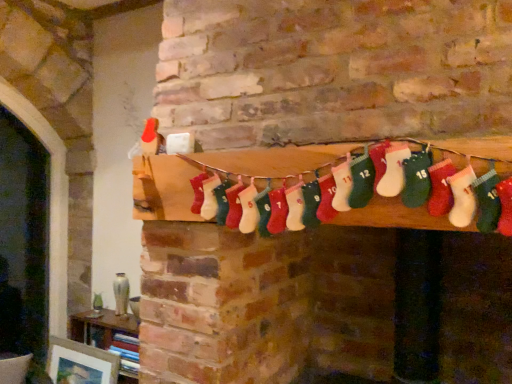
What is the approximate width of wooden bookshelf at lower left?

The width of wooden bookshelf at lower left is 22.72 centimeters.

Where is `red knitted stocking at center`? The height and width of the screenshot is (384, 512). red knitted stocking at center is located at coordinates pyautogui.click(x=338, y=186).

Identify the location of wooden bookshelf at lower left. (101, 327).

Measure the distance between red knitted stocking at center and wooden bookshelf at lower left.

They are 5.49 feet apart.

From the image's perspective, is red knitted stocking at center positioned above or below wooden bookshelf at lower left?

Based on their image positions, red knitted stocking at center is located above wooden bookshelf at lower left.

Which object is thinner, red knitted stocking at center or wooden bookshelf at lower left?

red knitted stocking at center.

Is red knitted stocking at center behind wooden bookshelf at lower left?

No, it is in front of wooden bookshelf at lower left.

Based on their positions, is matte white picture frame at lower left located to the left or right of red knitted stocking at center?

matte white picture frame at lower left is positioned on red knitted stocking at center's left side.

Between point (106, 357) and point (184, 203), which one is positioned behind?

The point (106, 357) is farther from the camera.

Is red knitted stocking at center inside matte white picture frame at lower left?

No, red knitted stocking at center is not inside matte white picture frame at lower left.

Which of these two, matte white picture frame at lower left or red knitted stocking at center, stands shorter?

red knitted stocking at center is shorter.

Considering the sizes of red knitted stocking at center and matte white picture frame at lower left in the image, is red knitted stocking at center taller or shorter than matte white picture frame at lower left?

Clearly, red knitted stocking at center is shorter compared to matte white picture frame at lower left.

Is red knitted stocking at center aimed at matte white picture frame at lower left?

No, red knitted stocking at center does not turn towards matte white picture frame at lower left.

From a real-world perspective, who is located higher, red knitted stocking at center or matte white picture frame at lower left?

red knitted stocking at center is physically above.

Which is more to the right, wooden bookshelf at lower left or red knitted stocking at center?

red knitted stocking at center is more to the right.

Which is correct: wooden bookshelf at lower left is inside red knitted stocking at center, or outside of it?

wooden bookshelf at lower left is not inside red knitted stocking at center, it's outside.

Who is bigger, wooden bookshelf at lower left or red knitted stocking at center?

With larger size is wooden bookshelf at lower left.

How much distance is there between matte white picture frame at lower left and wooden bookshelf at lower left?

5.09 inches.

Between matte white picture frame at lower left and wooden bookshelf at lower left, which one has larger size?

wooden bookshelf at lower left.

Which object is further away from the camera, matte white picture frame at lower left or wooden bookshelf at lower left?

Positioned behind is wooden bookshelf at lower left.

Is wooden bookshelf at lower left completely or partially outside of matte white picture frame at lower left?

That's correct, wooden bookshelf at lower left is outside of matte white picture frame at lower left.

Can you confirm if wooden bookshelf at lower left is wider than matte white picture frame at lower left?

Correct, the width of wooden bookshelf at lower left exceeds that of matte white picture frame at lower left.

Is wooden bookshelf at lower left smaller than matte white picture frame at lower left?

No.

At what (x,y) coordinates should I click in order to perform the action: click on sock lying on the right of wooden bookshelf at lower left. Please return your answer as a coordinate pair (x, y). This screenshot has width=512, height=384. Looking at the image, I should click on (338, 186).

What are the coordinates of `picture frame located behind the red knitted stocking at center` in the screenshot? It's located at (80, 363).

Which object lies nearer to the anchor point wooden bookshelf at lower left, matte white picture frame at lower left or red knitted stocking at center?

Based on the image, matte white picture frame at lower left appears to be nearer to wooden bookshelf at lower left.

Looking at the image, which one is located closer to matte white picture frame at lower left, wooden bookshelf at lower left or red knitted stocking at center?

wooden bookshelf at lower left.

Consider the image. When comparing their distances from matte white picture frame at lower left, does red knitted stocking at center or wooden bookshelf at lower left seem closer?

The object closer to matte white picture frame at lower left is wooden bookshelf at lower left.

From the picture: Estimate the real-world distances between objects in this image. Which object is closer to red knitted stocking at center, matte white picture frame at lower left or wooden bookshelf at lower left?

wooden bookshelf at lower left lies closer to red knitted stocking at center than the other object.

Estimate the real-world distances between objects in this image. Which object is closer to red knitted stocking at center, wooden bookshelf at lower left or matte white picture frame at lower left?

Among the two, wooden bookshelf at lower left is located nearer to red knitted stocking at center.

Considering their positions, is red knitted stocking at center positioned further to wooden bookshelf at lower left than matte white picture frame at lower left?

Based on the image, red knitted stocking at center appears to be further to wooden bookshelf at lower left.

Locate an element on the screen. picture frame located between red knitted stocking at center and wooden bookshelf at lower left in the depth direction is located at coordinates (80, 363).